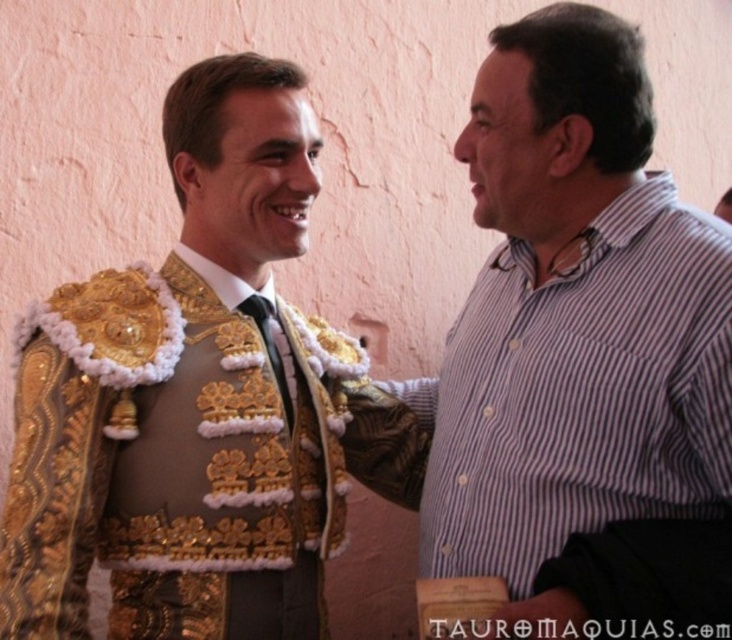
Question: Can you confirm if striped cotton shirt at right is wider than black satin tie at center?

Choices:
 (A) no
 (B) yes

Answer: (B)

Question: Can you confirm if gold embroidered jacket at left is positioned below black satin tie at center?

Choices:
 (A) yes
 (B) no

Answer: (B)

Question: Which object is closer to the camera taking this photo?

Choices:
 (A) black satin tie at center
 (B) gold embroidered jacket at left

Answer: (B)

Question: Among these objects, which one is nearest to the camera?

Choices:
 (A) striped cotton shirt at right
 (B) gold embroidered jacket at left

Answer: (A)

Question: Is gold embroidered jacket at left positioned before black satin tie at center?

Choices:
 (A) yes
 (B) no

Answer: (A)

Question: Among these objects, which one is nearest to the camera?

Choices:
 (A) striped cotton shirt at right
 (B) black satin tie at center
 (C) gold embroidered jacket at left

Answer: (A)